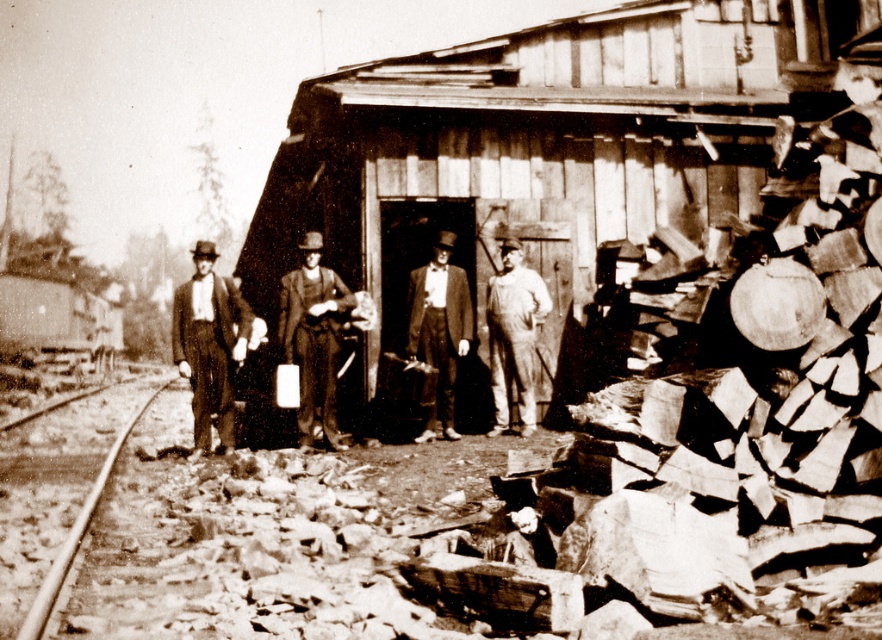
Question: Is smooth black suit at left to the left of smooth black suit at center from the viewer's perspective?

Choices:
 (A) yes
 (B) no

Answer: (A)

Question: Which point appears closest to the camera in this image?

Choices:
 (A) (438, 253)
 (B) (326, 371)
 (C) (1, 554)
 (D) (330, 81)

Answer: (C)

Question: Which object is the farthest from the smooth black suit at center?

Choices:
 (A) wooden hut at center
 (B) smooth leather hat at center
 (C) smooth metal track at lower left
 (D) denim overalls at center

Answer: (C)

Question: Among these objects, which one is farthest from the camera?

Choices:
 (A) wooden hut at center
 (B) smooth metal track at lower left

Answer: (A)

Question: Does wooden hut at center appear on the right side of smooth leather hat at center?

Choices:
 (A) no
 (B) yes

Answer: (A)

Question: Does smooth black suit at left have a smaller size compared to smooth leather hat at center?

Choices:
 (A) yes
 (B) no

Answer: (A)